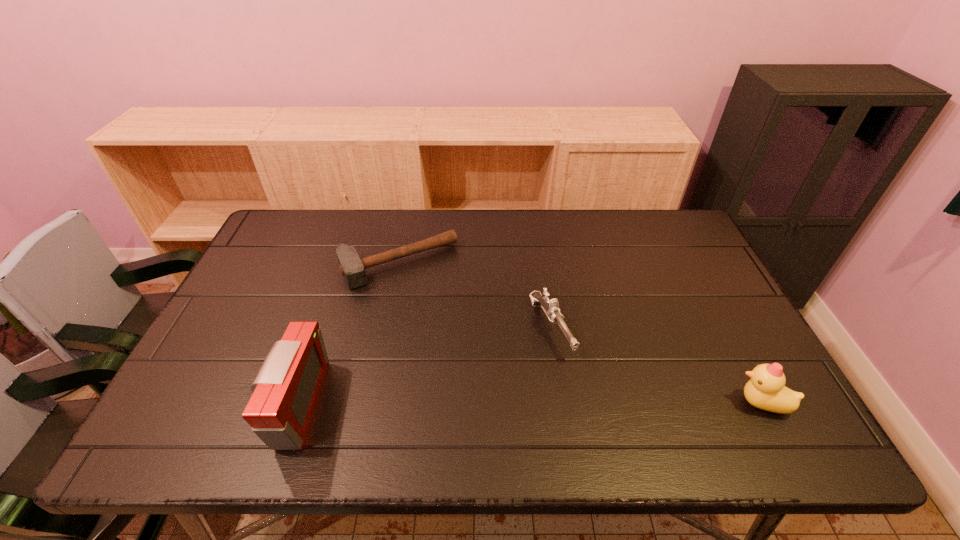
Locate an element on the screen. the tallest object is located at coordinates (286, 390).

In order to click on the third shortest object in this screenshot , I will do `click(766, 390)`.

I want to click on the rightmost object, so click(766, 390).

I want to click on the second object from right to left, so click(x=550, y=306).

The image size is (960, 540). What are the coordinates of `gun` in the screenshot? It's located at (550, 306).

You are a GUI agent. You are given a task and a screenshot of the screen. Output one action in this format:
    pyautogui.click(x=<x>, y=<y>)
    Task: Click on the hammer
    The height and width of the screenshot is (540, 960).
    Given the screenshot: What is the action you would take?
    pyautogui.click(x=351, y=266)

Locate an element on the screen. the shortest object is located at coordinates (351, 266).

I want to click on free region located on the front-facing side of the camera, so click(x=195, y=403).

This screenshot has height=540, width=960. In order to click on vacant space located 0.070m on the front-facing side of the camera in this screenshot , I will do `click(247, 403)`.

Where is `vacant space located on the front-facing side of the camera`? The width and height of the screenshot is (960, 540). vacant space located on the front-facing side of the camera is located at coordinates click(x=216, y=403).